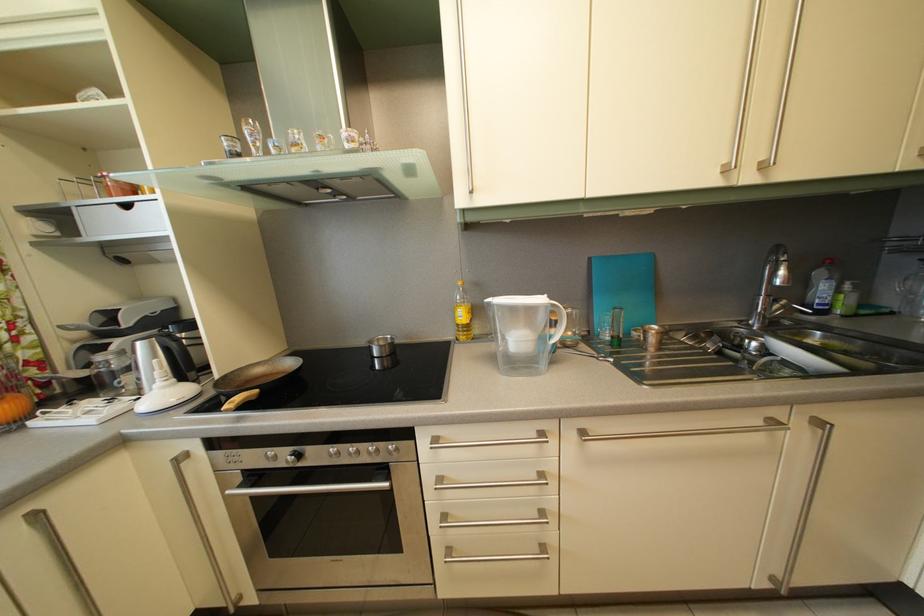
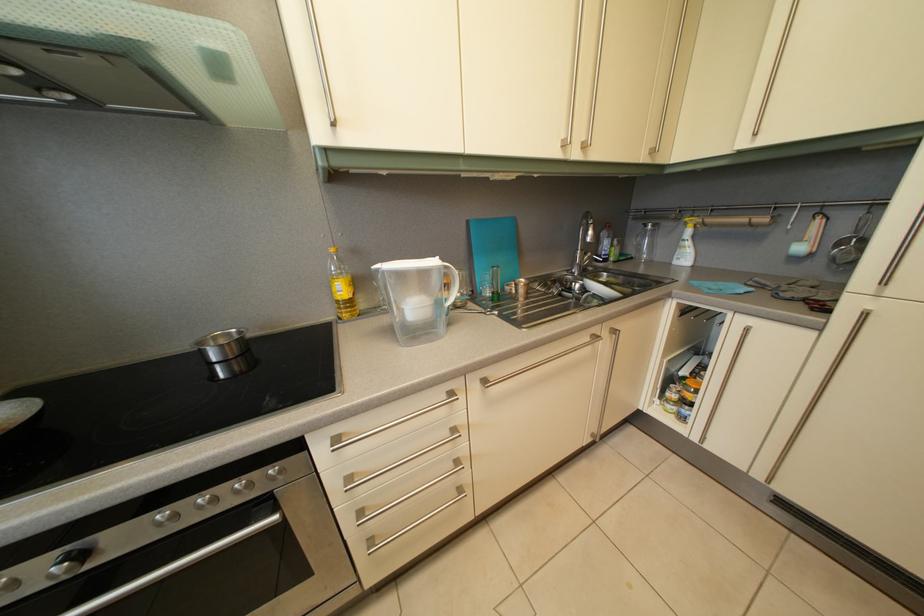
Locate, in the second image, the point that corresponds to [308,464] in the first image.

(92, 562)